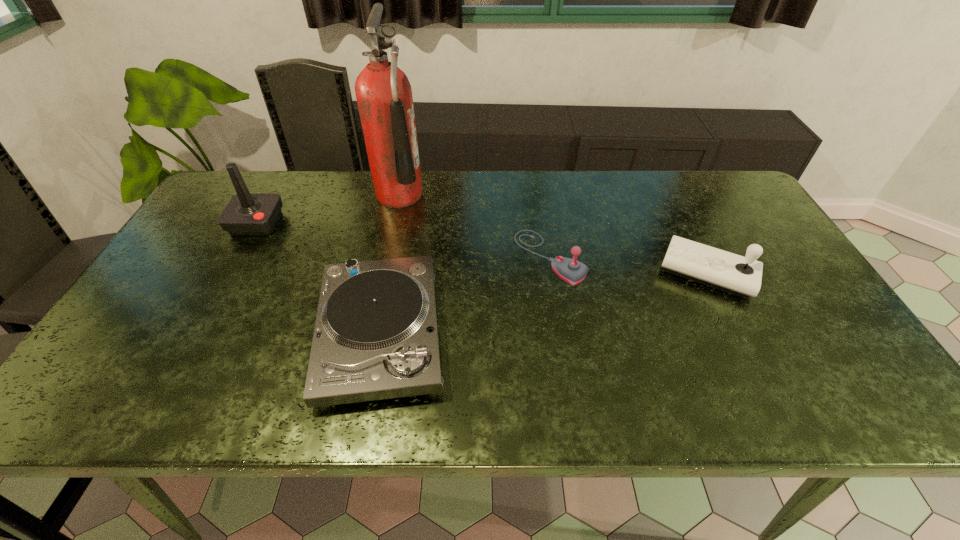
Where is `vacant space that's between the rightmost object and the leftmost object`? The height and width of the screenshot is (540, 960). vacant space that's between the rightmost object and the leftmost object is located at coordinates (482, 248).

Locate an element on the screen. vacant space in between the rightmost joystick and the second object from right to left is located at coordinates (629, 265).

At what (x,y) coordinates should I click in order to perform the action: click on free spot between the fire extinguisher and the second joystick from left to right. Please return your answer as a coordinate pair (x, y). Looking at the image, I should click on (474, 226).

This screenshot has height=540, width=960. In order to click on empty location between the rightmost object and the fourth object from left to right in this screenshot , I will do `click(629, 265)`.

Select which object is the second closest to the tallest object. Please provide its 2D coordinates. Your answer should be formatted as a tuple, i.e. [(x, y)], where the tuple contains the x and y coordinates of a point satisfying the conditions above.

[(247, 214)]

This screenshot has width=960, height=540. Identify the location of the third closest object to the record player. (247, 214).

The height and width of the screenshot is (540, 960). I want to click on joystick object that ranks as the closest to the record player, so click(x=572, y=271).

Where is `the second closest joystick to the tallest object`? The width and height of the screenshot is (960, 540). the second closest joystick to the tallest object is located at coordinates (572, 271).

The height and width of the screenshot is (540, 960). I want to click on vacant region that satisfies the following two spatial constraints: 1. on the front of the record player near the operation label; 2. on the left side of the tallest object, so [370, 333].

Locate an element on the screen. The image size is (960, 540). free space in the image that satisfies the following two spatial constraints: 1. on the front of the tallest object near the operation label; 2. on the right side of the record player is located at coordinates (370, 333).